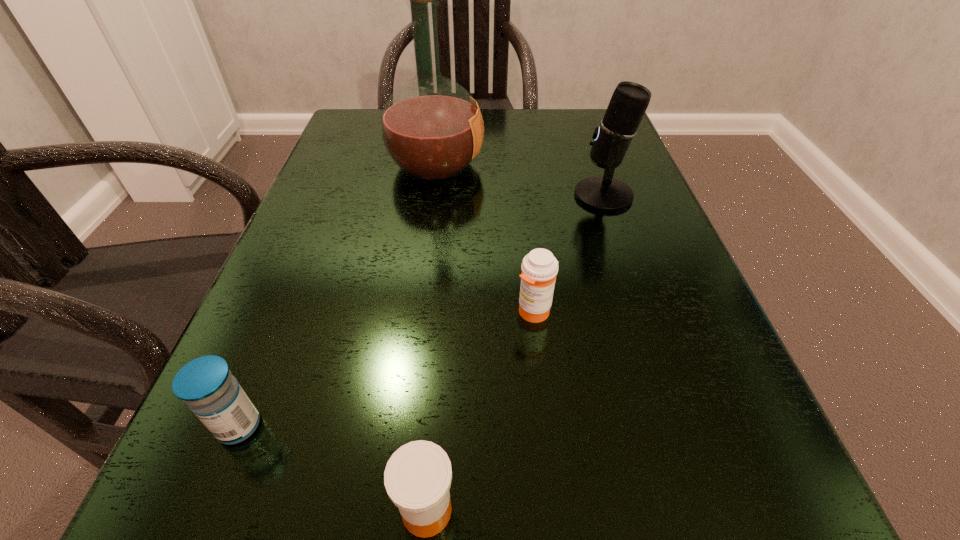
Locate which medicine ranks second in proximity to the microphone. Please provide its 2D coordinates. Your answer should be formatted as a tuple, i.e. [(x, y)], where the tuple contains the x and y coordinates of a point satisfying the conditions above.

[(418, 476)]

Locate which medicine ranks third in proximity to the rightmost object. Please provide its 2D coordinates. Your answer should be formatted as a tuple, i.e. [(x, y)], where the tuple contains the x and y coordinates of a point satisfying the conditions above.

[(206, 384)]

At what (x,y) coordinates should I click in order to perform the action: click on vacant area in the image that satisfies the following two spatial constraints: 1. on the front label of the tallest object; 2. on the back side of the farthest medicine. Please return your answer as a coordinate pair (x, y). The width and height of the screenshot is (960, 540). Looking at the image, I should click on (416, 312).

Where is `free space that satisfies the following two spatial constraints: 1. on the front label of the tallest object; 2. on the left side of the third farthest object`? This screenshot has height=540, width=960. free space that satisfies the following two spatial constraints: 1. on the front label of the tallest object; 2. on the left side of the third farthest object is located at coordinates click(x=416, y=312).